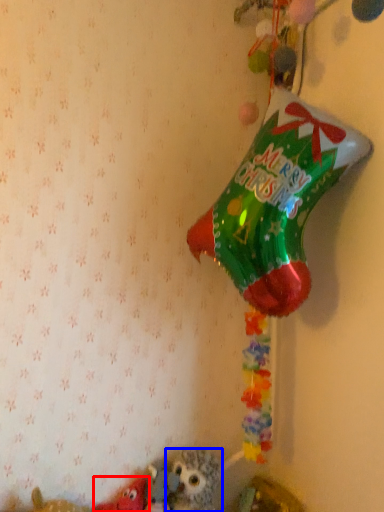
Question: Which point is closer to the camera, toy (highlighted by a red box) or toy (highlighted by a blue box)?

Choices:
 (A) toy
 (B) toy

Answer: (A)